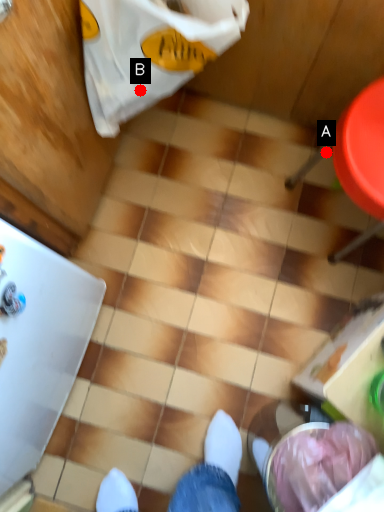
Question: Two points are circled on the image, labeled by A and B beside each circle. Among these points, which one is farthest from the camera?

Choices:
 (A) A is further
 (B) B is further

Answer: (A)